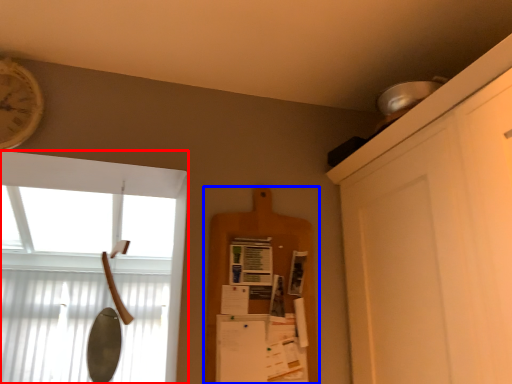
Question: Which point is closer to the camera, window (highlighted by a red box) or shelf (highlighted by a blue box)?

Choices:
 (A) window
 (B) shelf

Answer: (A)